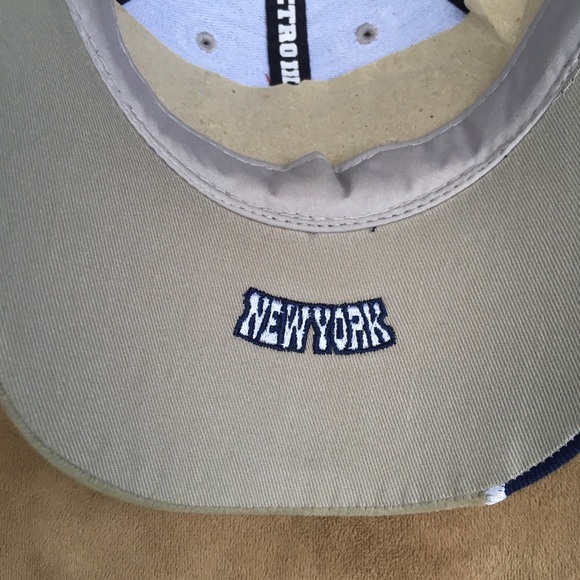
Find the location of a particular element. The height and width of the screenshot is (580, 580). vent holes is located at coordinates (206, 44), (369, 32).